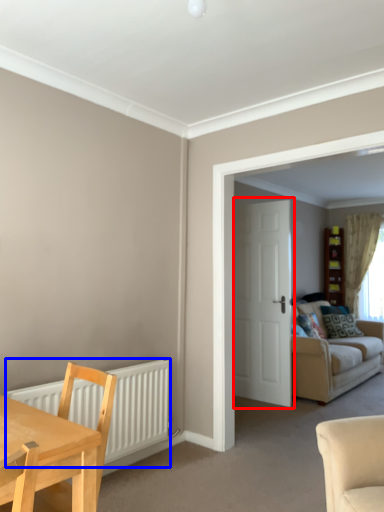
Question: Which of the following is the closest to the observer, door (highlighted by a red box) or radiator (highlighted by a blue box)?

Choices:
 (A) door
 (B) radiator

Answer: (B)